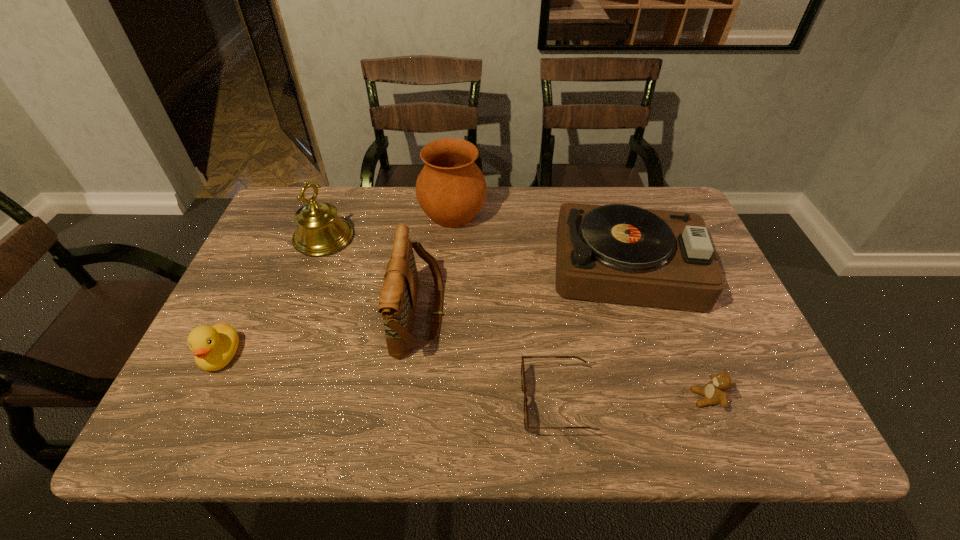
At what (x,y) coordinates should I click in order to perform the action: click on pottery. Please return your answer as a coordinate pair (x, y). Image resolution: width=960 pixels, height=540 pixels. Looking at the image, I should click on (451, 189).

Find the location of `bell`. bell is located at coordinates (320, 231).

At what (x,y) coordinates should I click in order to perform the action: click on shoulder bag. Please return your answer as a coordinate pair (x, y). This screenshot has height=540, width=960. Looking at the image, I should click on (397, 303).

This screenshot has height=540, width=960. I want to click on the fourth shortest object, so click(x=618, y=253).

At what (x,y) coordinates should I click in order to perform the action: click on the third shortest object. Please return your answer as a coordinate pair (x, y). The width and height of the screenshot is (960, 540). Looking at the image, I should click on (214, 347).

The height and width of the screenshot is (540, 960). I want to click on duckling, so click(214, 347).

You are a GUI agent. You are given a task and a screenshot of the screen. Output one action in this format:
    pyautogui.click(x=<x>, y=<y>)
    Task: Click on the teddy bear
    This screenshot has width=960, height=540.
    Given the screenshot: What is the action you would take?
    pyautogui.click(x=715, y=392)

At what (x,y) coordinates should I click in order to perform the action: click on the shortest object. Please return your answer as a coordinate pair (x, y). Looking at the image, I should click on (526, 420).

Find the location of a particular element. This screenshot has width=960, height=540. vacant space situated on the right of the pottery is located at coordinates (540, 213).

This screenshot has width=960, height=540. I want to click on free region located on the left of the second object from left to right, so click(262, 238).